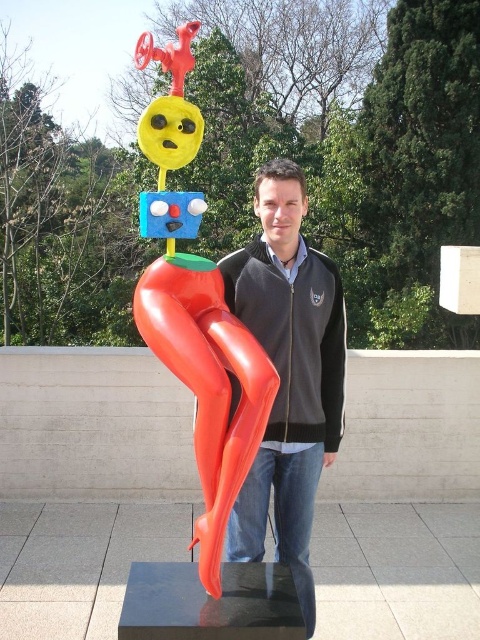
You are a photographer trying to capture the sculpture and the man in a single shot. The matte black jacket at center is positioned at coordinates 0.583 on the x and 0.600 on the y. Based on the scene description, where should you focus your camera to ensure both the sculpture and the man are in frame?

The matte black jacket at center is located at point (288, 372), so focusing the camera at this central position will ensure both the sculpture and the man are within the frame.

You are a photographer standing 5 feet away from the camera. You want to take a photo of the matte black jacket at center. Can you reach the camera to adjust it?

The matte black jacket at center and camera are 6.69 feet apart from each other. Since you are 5 feet away from the camera, the distance between you and the matte black jacket at center is 1.69 feet. Therefore, you can easily reach the camera to adjust it.